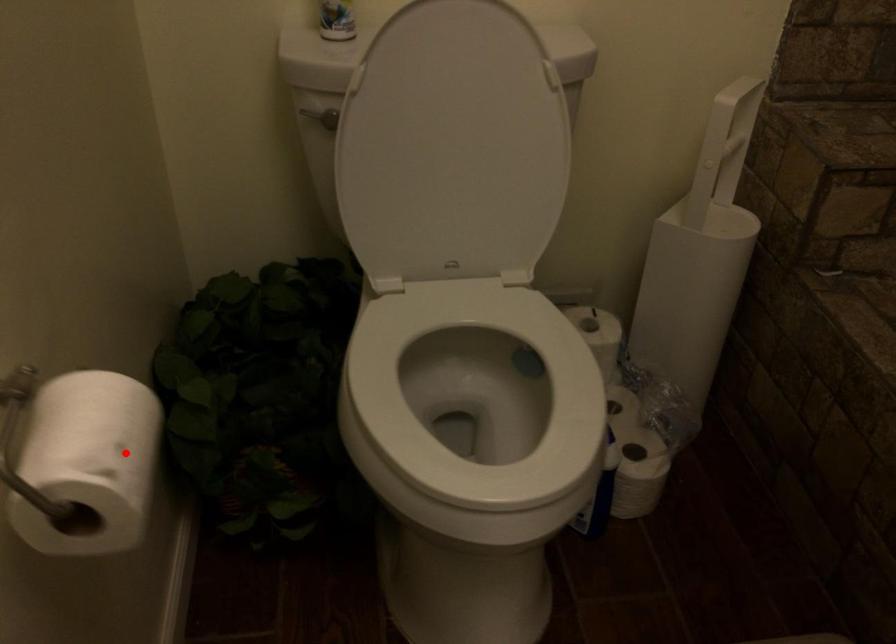
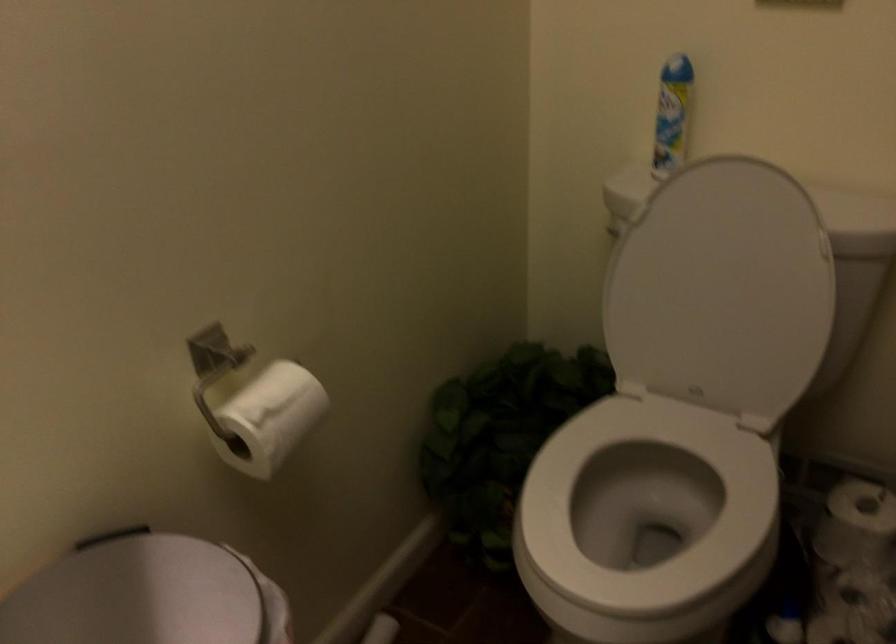
Question: I am providing you with two images of the same scene from different viewpoints. Given a red point in image1, look at the same physical point in image2. Is it:

Choices:
 (A) Closer to the viewpoint
 (B) Farther from the viewpoint

Answer: (B)